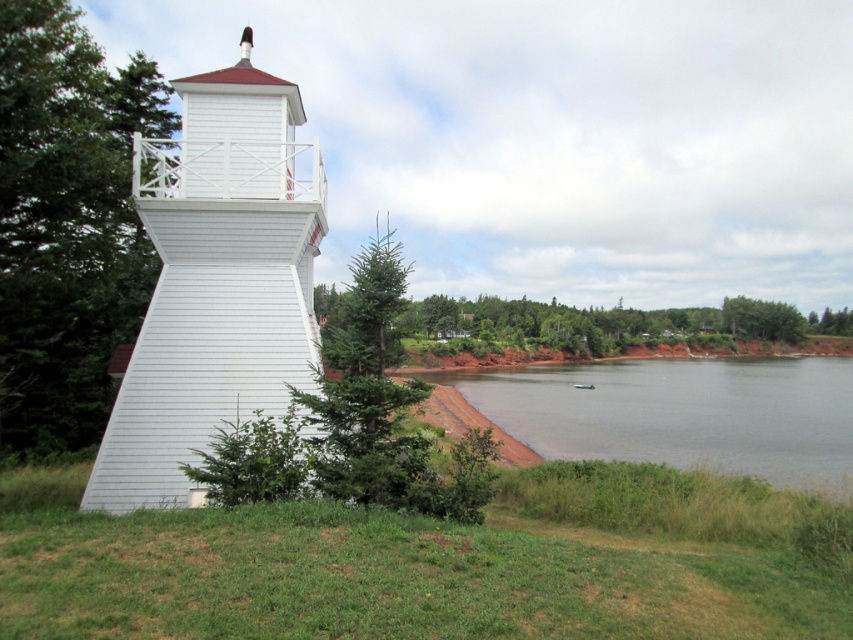
You are standing at the lighthouse and want to place a small flag at the point closer to you. Which point should you choose between point (x=338, y=572) and point (x=227, y=291)?

Point (x=338, y=572) is closer to the camera, so you should place the flag there.

You are standing at the shoreline and want to walk towards the white wooden tower at left. Which direction should you walk to avoid stepping on the green grassy at lower left?

To avoid stepping on the green grassy at lower left, you should walk towards the white wooden tower at left from the right side, as the green grassy at lower left is in front of the tower and blocking the direct path.